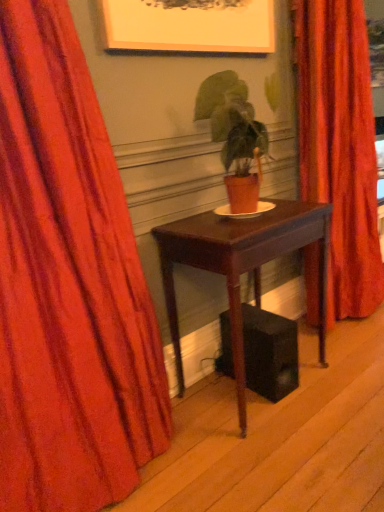
You are a GUI agent. You are given a task and a screenshot of the screen. Output one action in this format:
    pyautogui.click(x=<x>, y=<y>)
    Task: Click on the free space in front of velvet orange curtain at center, which ranks as the 1th curtain in back-to-front order
    The image size is (384, 512).
    Given the screenshot: What is the action you would take?
    click(354, 348)